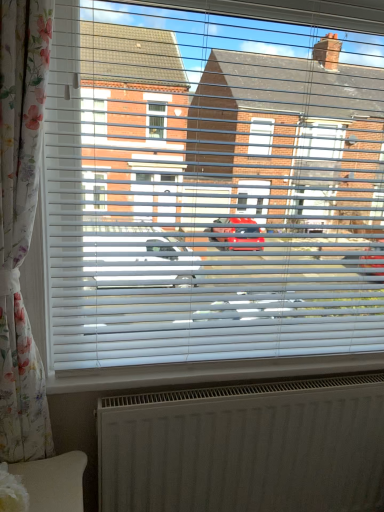
Question: Is floral fabric curtain at left behind white textured radiator at lower center?

Choices:
 (A) yes
 (B) no

Answer: (B)

Question: Can you confirm if floral fabric curtain at left is positioned to the left of white textured radiator at lower center?

Choices:
 (A) yes
 (B) no

Answer: (A)

Question: Considering the relative sizes of floral fabric curtain at left and white textured radiator at lower center in the image provided, is floral fabric curtain at left taller than white textured radiator at lower center?

Choices:
 (A) yes
 (B) no

Answer: (A)

Question: Is floral fabric curtain at left positioned with its back to white textured radiator at lower center?

Choices:
 (A) no
 (B) yes

Answer: (A)

Question: Is floral fabric curtain at left wider than white textured radiator at lower center?

Choices:
 (A) no
 (B) yes

Answer: (B)

Question: Considering the positions of point (1, 440) and point (279, 423), is point (1, 440) closer or farther from the camera than point (279, 423)?

Choices:
 (A) closer
 (B) farther

Answer: (A)

Question: In terms of height, does floral fabric curtain at left look taller or shorter compared to white textured radiator at lower center?

Choices:
 (A) tall
 (B) short

Answer: (A)

Question: From the image's perspective, relative to white textured radiator at lower center, is floral fabric curtain at left above or below?

Choices:
 (A) below
 (B) above

Answer: (B)

Question: Visually, is floral fabric curtain at left positioned to the left or to the right of white textured radiator at lower center?

Choices:
 (A) right
 (B) left

Answer: (B)

Question: Is floral fabric curtain at left taller or shorter than white plastic blinds at center?

Choices:
 (A) tall
 (B) short

Answer: (A)

Question: Visually, is floral fabric curtain at left positioned to the left or to the right of white plastic blinds at center?

Choices:
 (A) right
 (B) left

Answer: (B)

Question: Is floral fabric curtain at left bigger or smaller than white plastic blinds at center?

Choices:
 (A) big
 (B) small

Answer: (B)

Question: Is floral fabric curtain at left inside the boundaries of white plastic blinds at center, or outside?

Choices:
 (A) inside
 (B) outside

Answer: (B)

Question: Is white textured radiator at lower center situated inside floral fabric curtain at left or outside?

Choices:
 (A) outside
 (B) inside

Answer: (A)

Question: Based on their sizes in the image, would you say white textured radiator at lower center is bigger or smaller than floral fabric curtain at left?

Choices:
 (A) big
 (B) small

Answer: (A)